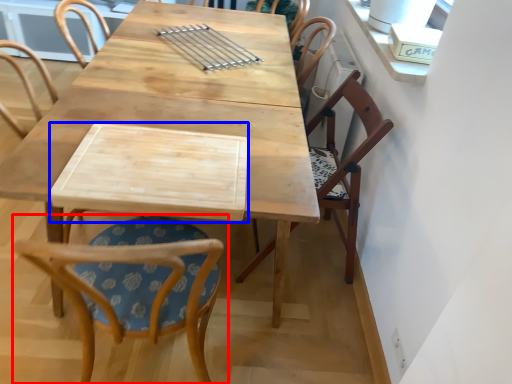
Question: Which object is closer to the camera taking this photo, chair (highlighted by a red box) or plank (highlighted by a blue box)?

Choices:
 (A) chair
 (B) plank

Answer: (A)